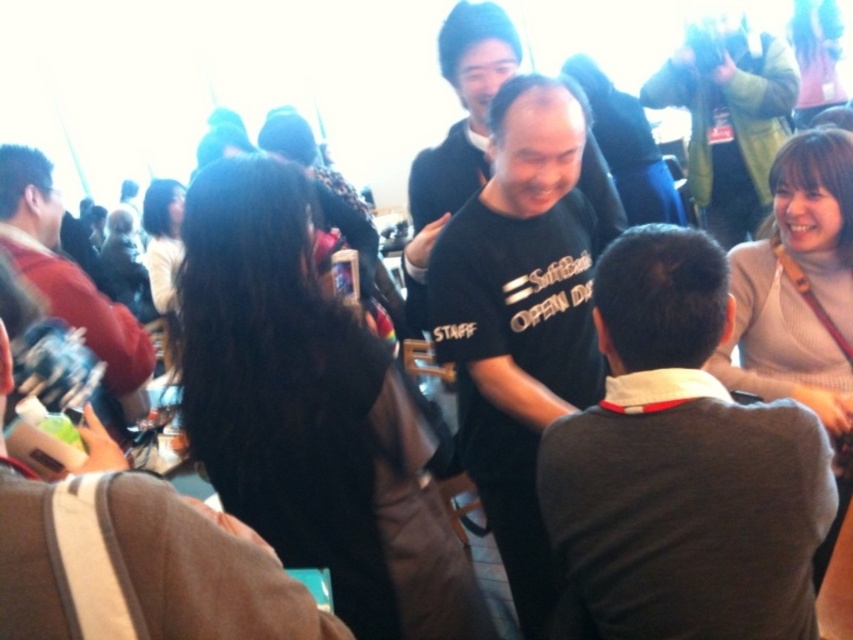
Is dark gray shirt at center thinner than matte black shirt at left?

Yes.

Can you confirm if dark gray shirt at center is taller than matte black shirt at left?

Incorrect, dark gray shirt at center's height is not larger of matte black shirt at left's.

Measure the distance between point (572, 477) and camera.

3.95 feet

The image size is (853, 640). Identify the location of dark gray shirt at center. (680, 468).

Is black matte shirt at center positioned in front of matte black shirt at left?

Yes, it is.

Based on the photo, is black matte shirt at center wider than matte black shirt at left?

Incorrect, black matte shirt at center's width does not surpass matte black shirt at left's.

Between point (518, 392) and point (70, 320), which one is positioned in front?

Point (518, 392)

Find the location of `black matte shirt at center`. black matte shirt at center is located at coordinates (519, 316).

Is black matte shirt at center taller than matte black shirt at upper right?

Yes.

What do you see at coordinates (519, 316) in the screenshot?
I see `black matte shirt at center` at bounding box center [519, 316].

This screenshot has height=640, width=853. I want to click on black matte shirt at center, so click(519, 316).